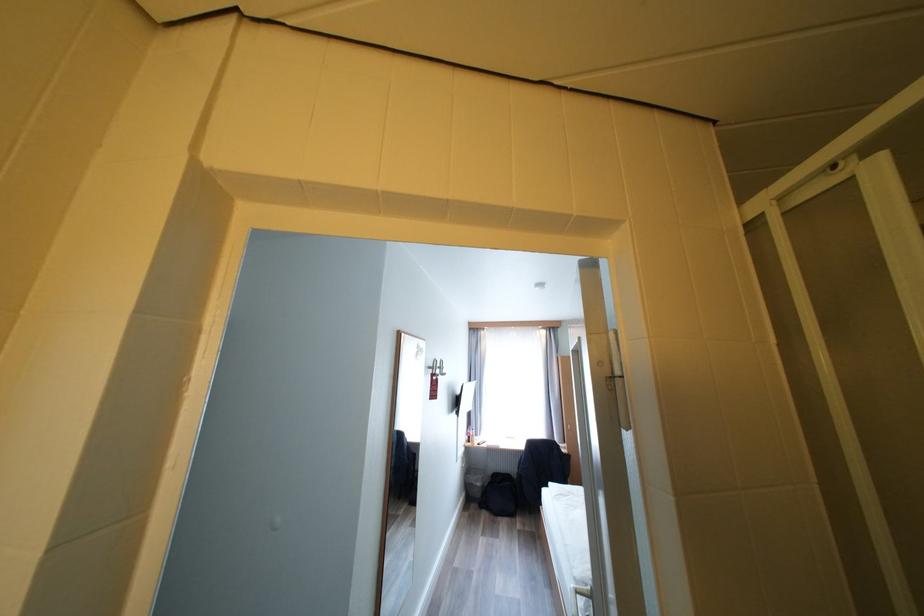
The image size is (924, 616). Find the location of `red door tag`. red door tag is located at coordinates (432, 387).